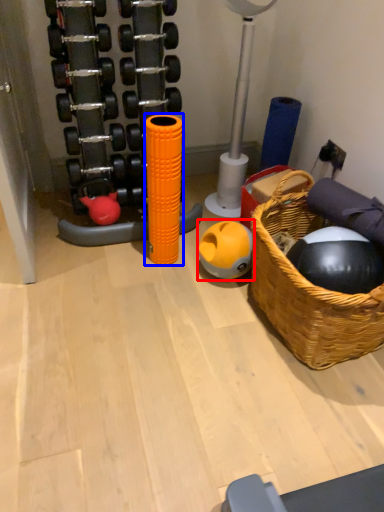
Question: Which object appears closest to the camera in this image, ball (highlighted by a red box) or toy (highlighted by a blue box)?

Choices:
 (A) ball
 (B) toy

Answer: (B)